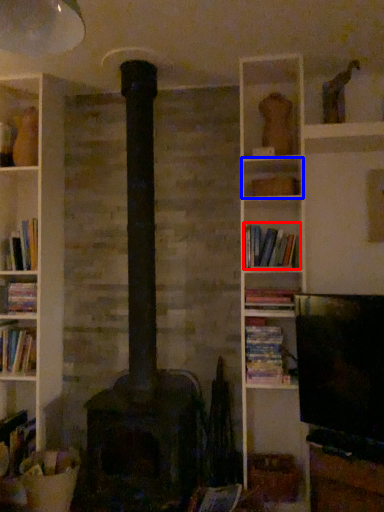
Question: Which object appears closest to the camera in this image, book (highlighted by a red box) or shelf (highlighted by a blue box)?

Choices:
 (A) book
 (B) shelf

Answer: (A)